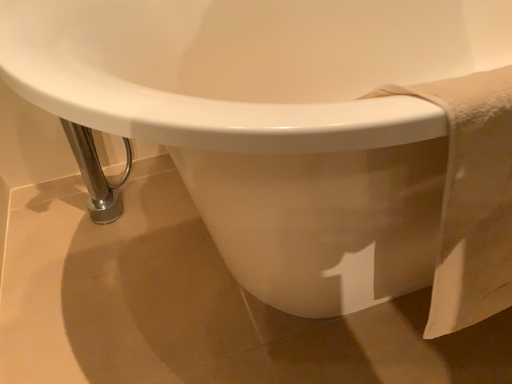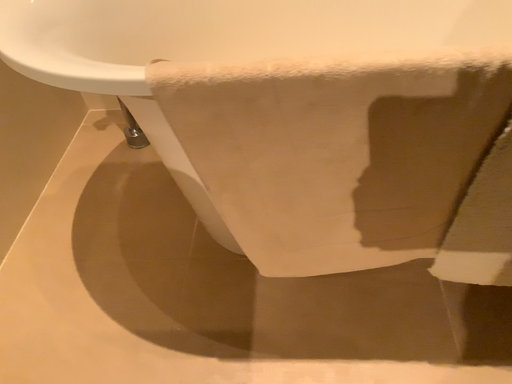
Question: Which way did the camera rotate in the video?

Choices:
 (A) rotated right
 (B) rotated left

Answer: (B)